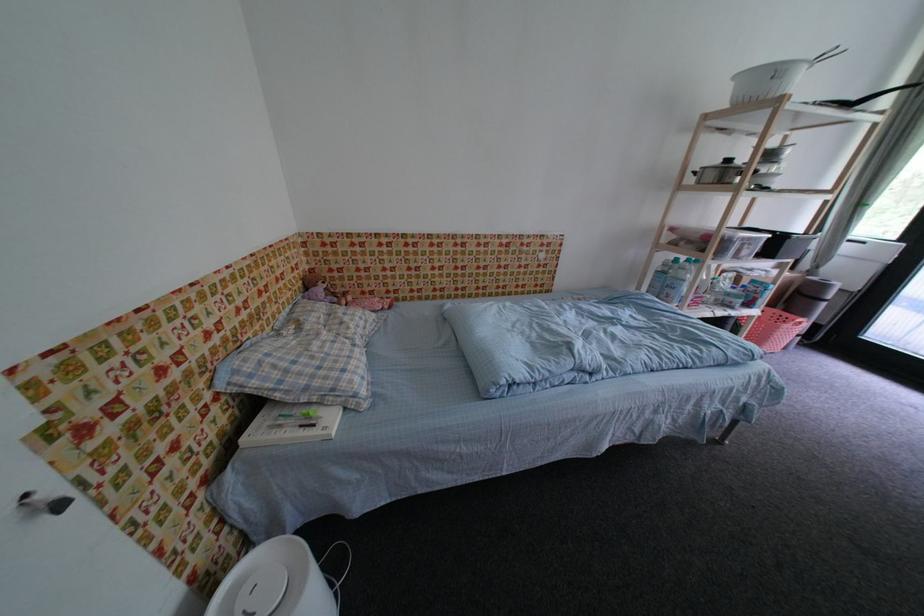
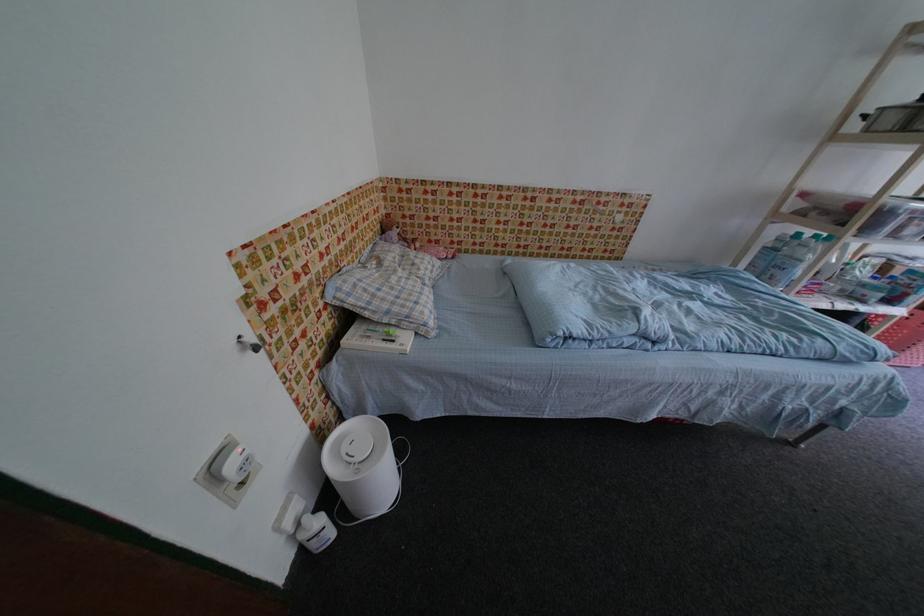
The point at (675,293) is marked in the first image. Where is the corresponding point in the second image?

(782, 274)